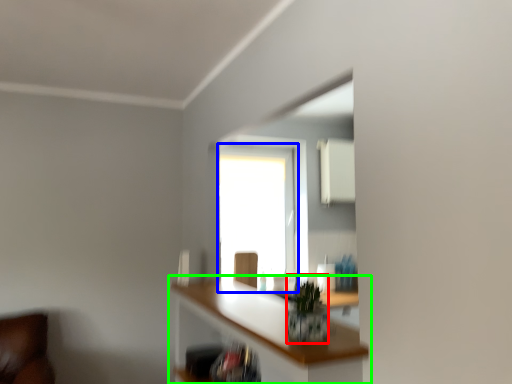
Question: Which object is the farthest from plant (highlighted by a red box)? Choose among these: window (highlighted by a blue box) or shelf (highlighted by a green box).

Choices:
 (A) window
 (B) shelf

Answer: (A)